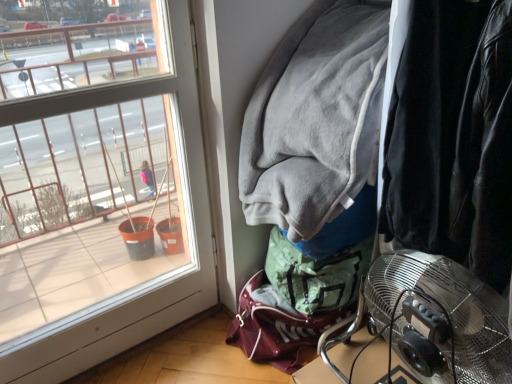
Question: Is clear glass window at left further to the viewer compared to metallic silver fan at lower right?

Choices:
 (A) yes
 (B) no

Answer: (A)

Question: Is clear glass window at left closer to the viewer compared to metallic silver fan at lower right?

Choices:
 (A) no
 (B) yes

Answer: (A)

Question: From a real-world perspective, is clear glass window at left located beneath metallic silver fan at lower right?

Choices:
 (A) yes
 (B) no

Answer: (B)

Question: From the image's perspective, is clear glass window at left beneath metallic silver fan at lower right?

Choices:
 (A) no
 (B) yes

Answer: (A)

Question: Considering the relative sizes of clear glass window at left and metallic silver fan at lower right in the image provided, is clear glass window at left shorter than metallic silver fan at lower right?

Choices:
 (A) yes
 (B) no

Answer: (B)

Question: From a real-world perspective, is metallic silver fan at lower right positioned above or below clear glass window at left?

Choices:
 (A) below
 (B) above

Answer: (A)

Question: Is metallic silver fan at lower right taller or shorter than clear glass window at left?

Choices:
 (A) tall
 (B) short

Answer: (B)

Question: From the image's perspective, relative to clear glass window at left, is metallic silver fan at lower right above or below?

Choices:
 (A) below
 (B) above

Answer: (A)

Question: In the image, is metallic silver fan at lower right positioned in front of or behind clear glass window at left?

Choices:
 (A) behind
 (B) front

Answer: (B)

Question: Is point (304, 29) positioned closer to the camera than point (274, 269)?

Choices:
 (A) farther
 (B) closer

Answer: (B)

Question: From a real-world perspective, is gray fleece jacket at upper right physically located above or below velvet black jacket at right?

Choices:
 (A) below
 (B) above

Answer: (B)

Question: Considering the positions of gray fleece jacket at upper right and velvet black jacket at right in the image, is gray fleece jacket at upper right wider or thinner than velvet black jacket at right?

Choices:
 (A) wide
 (B) thin

Answer: (B)

Question: Would you say gray fleece jacket at upper right is to the left or to the right of velvet black jacket at right in the picture?

Choices:
 (A) left
 (B) right

Answer: (A)

Question: From the image's perspective, is velvet black jacket at right located above or below gray fleece jacket at upper right?

Choices:
 (A) below
 (B) above

Answer: (A)

Question: Based on their sizes in the image, would you say velvet black jacket at right is bigger or smaller than gray fleece jacket at upper right?

Choices:
 (A) small
 (B) big

Answer: (B)